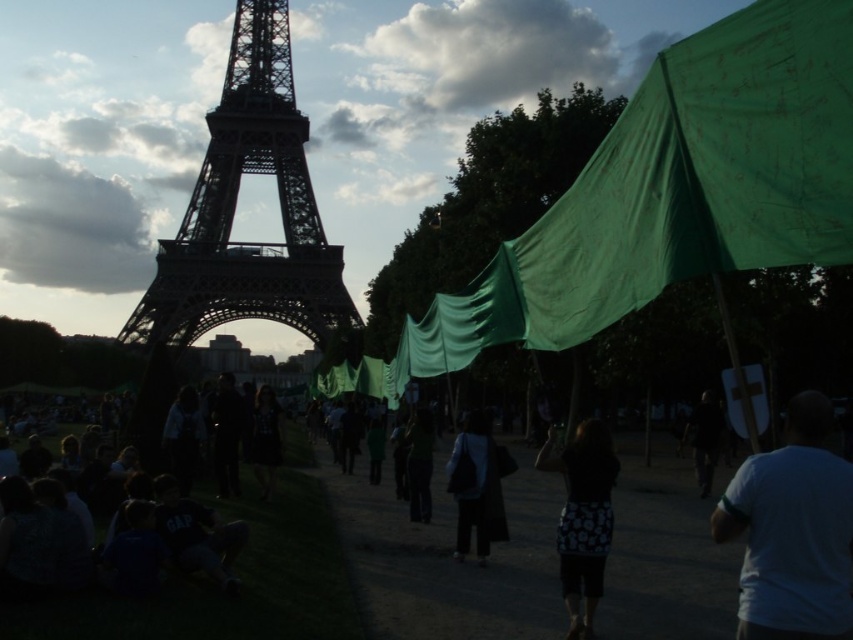
Between point (795, 449) and point (495, 481), which one is positioned in front?

Point (795, 449)

Can you confirm if white matte t-shirt at lower right is shorter than dark gray fabric bag at center?

No, white matte t-shirt at lower right is not shorter than dark gray fabric bag at center.

Is point (749, 618) positioned behind point (489, 472)?

No, it is in front of (489, 472).

Identify the location of white matte t-shirt at lower right. (792, 531).

Who is taller, dark steel eiffel tower at center or dark fabric bag at center?

dark steel eiffel tower at center

Who is positioned more to the left, dark steel eiffel tower at center or dark fabric bag at center?

From the viewer's perspective, dark steel eiffel tower at center appears more on the left side.

Does point (138, 310) come closer to viewer compared to point (698, 422)?

Yes, it is.

Find the location of a particular element. dark steel eiffel tower at center is located at coordinates (230, 227).

Looking at this image, which is above, green fabric canopy at right or dark gray fabric bag at center?

green fabric canopy at right is above.

In the scene shown: Who is more distant from viewer, (639, 188) or (466, 477)?

Point (466, 477)

At what (x,y) coordinates should I click in order to perform the action: click on green fabric canopy at right. Please return your answer as a coordinate pair (x, y). Looking at the image, I should click on (675, 189).